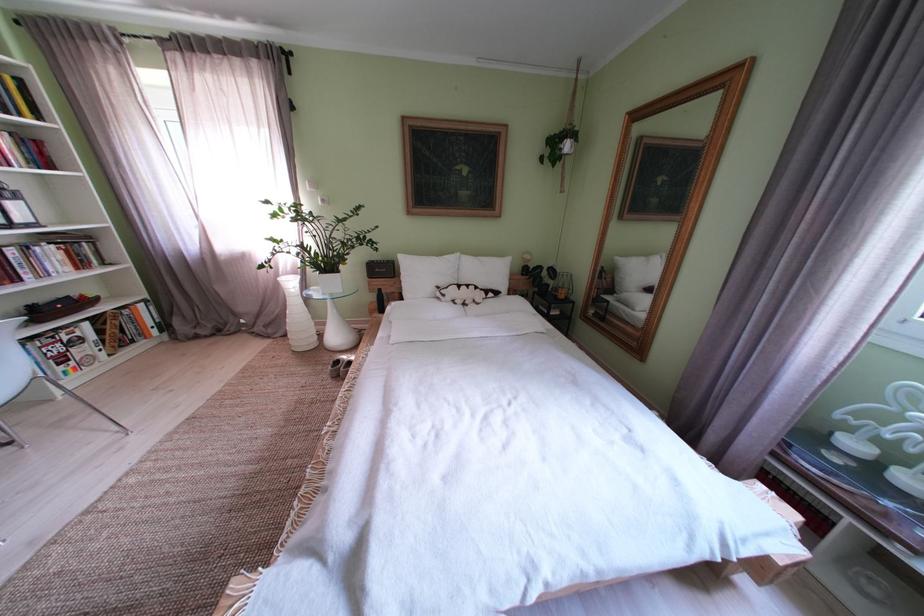
Where would you lift the hanging plant pot? Please return your answer as a coordinate pair (x, y).

(330, 281)